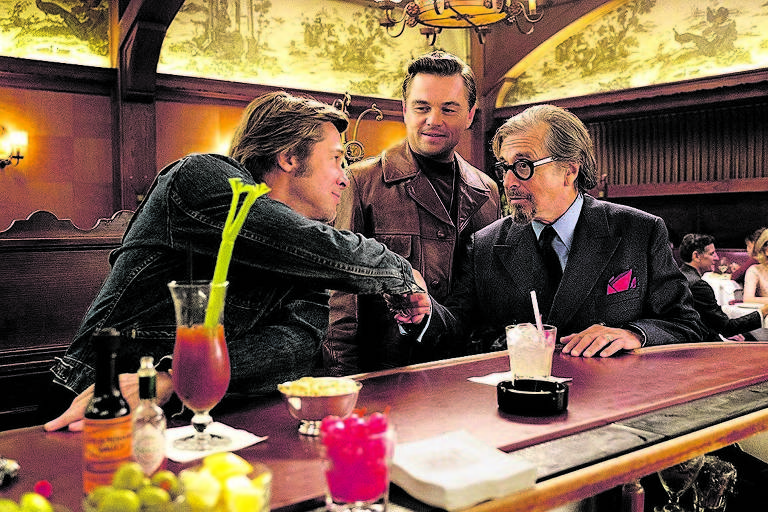
This screenshot has height=512, width=768. In order to click on wall lamp in this screenshot , I will do `click(12, 139)`.